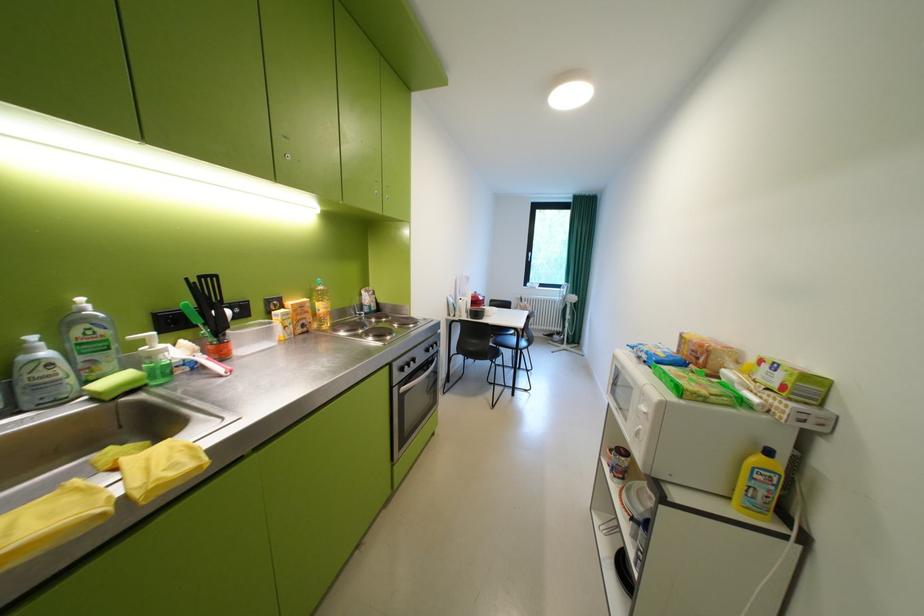
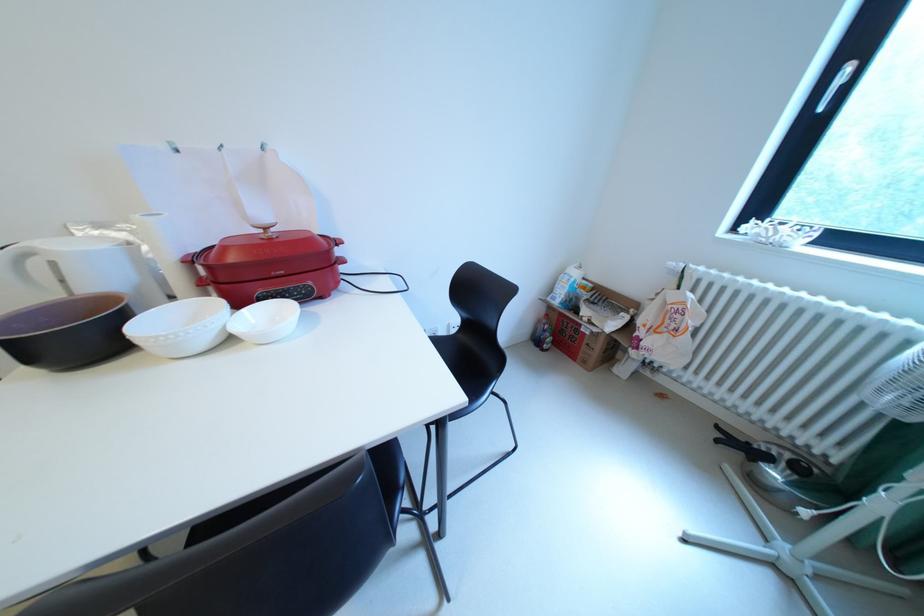
Locate, in the second image, the point that corresponds to the point at 532,305 in the first image.

(682, 297)